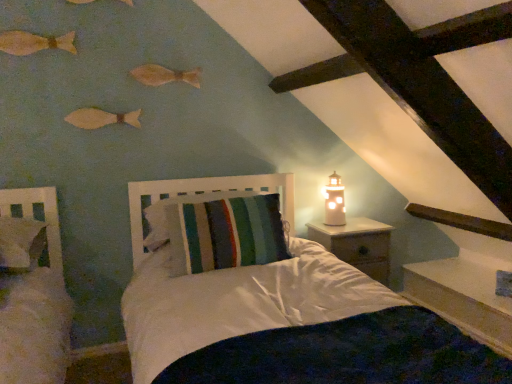
Where is `free location above wooden nightstand at right (from a real-world perspective)`? This screenshot has height=384, width=512. free location above wooden nightstand at right (from a real-world perspective) is located at coordinates (350, 228).